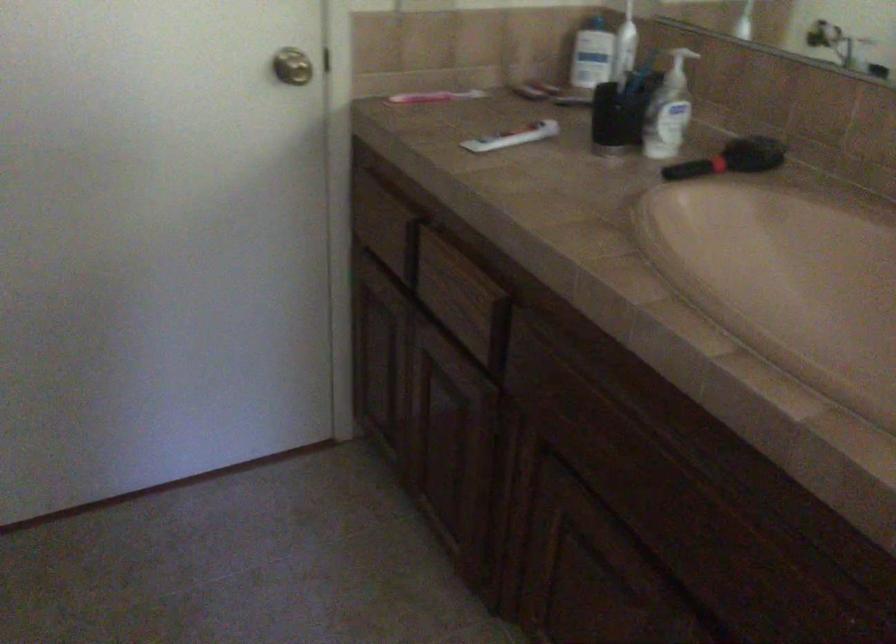
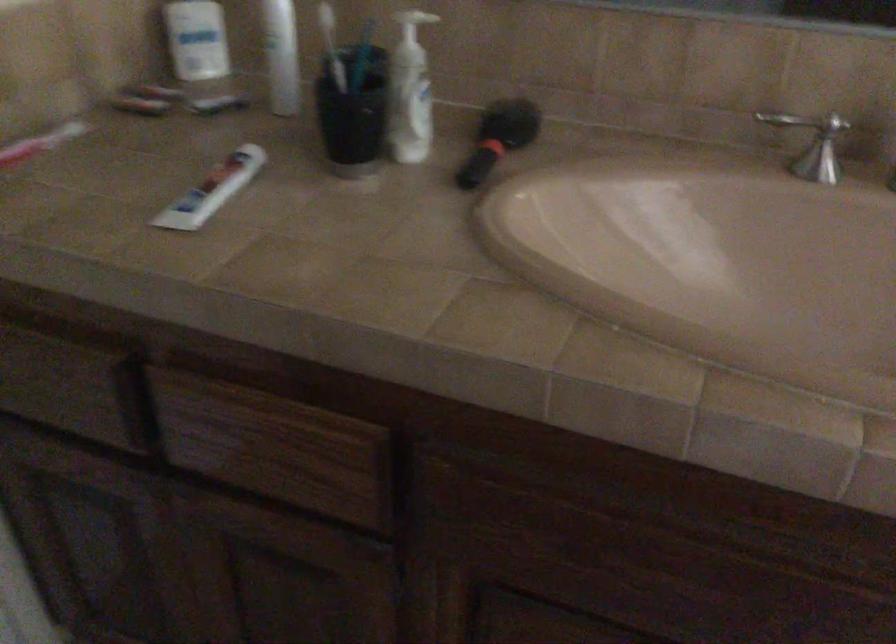
In the second image, find the point that corresponds to pixel 504 131 in the first image.

(211, 190)